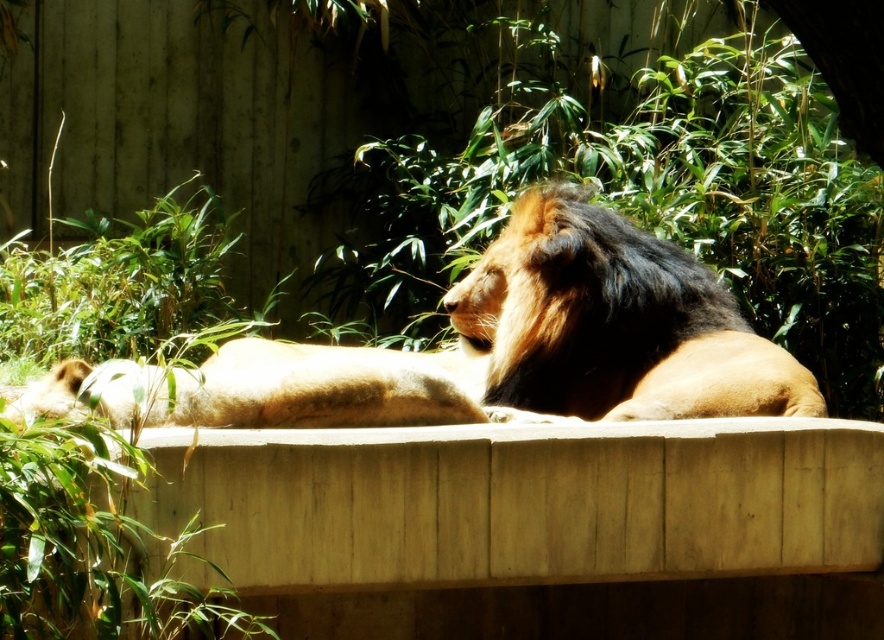
Question: Is brown fur lion at center to the left of golden fur lion at center from the viewer's perspective?

Choices:
 (A) yes
 (B) no

Answer: (A)

Question: Can you confirm if brown fur lion at center is wider than golden fur lion at center?

Choices:
 (A) no
 (B) yes

Answer: (B)

Question: Is brown fur lion at center below golden fur lion at center?

Choices:
 (A) yes
 (B) no

Answer: (B)

Question: Which point is closer to the camera?

Choices:
 (A) (714, 292)
 (B) (574, 346)

Answer: (B)

Question: Among these points, which one is nearest to the camera?

Choices:
 (A) (523, 241)
 (B) (498, 360)

Answer: (A)